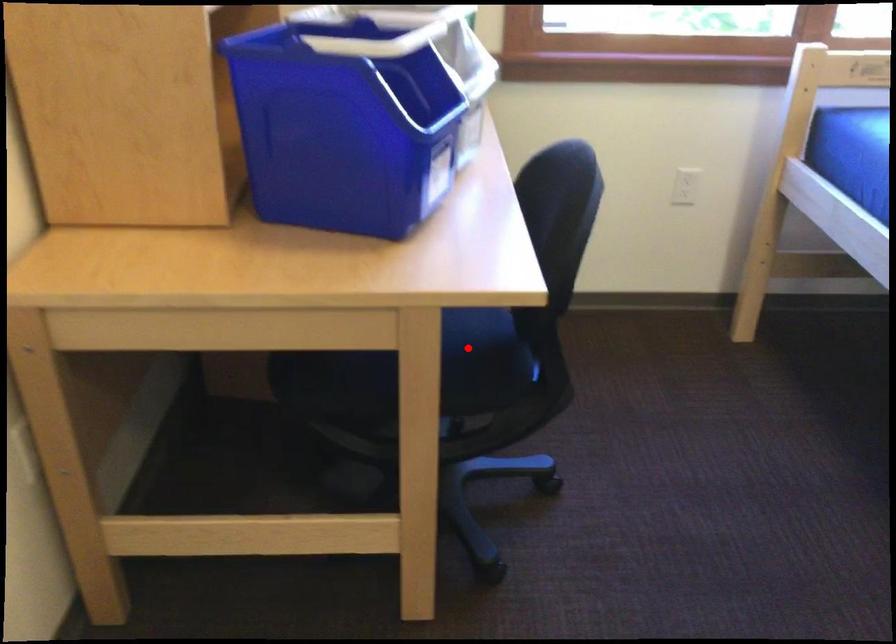
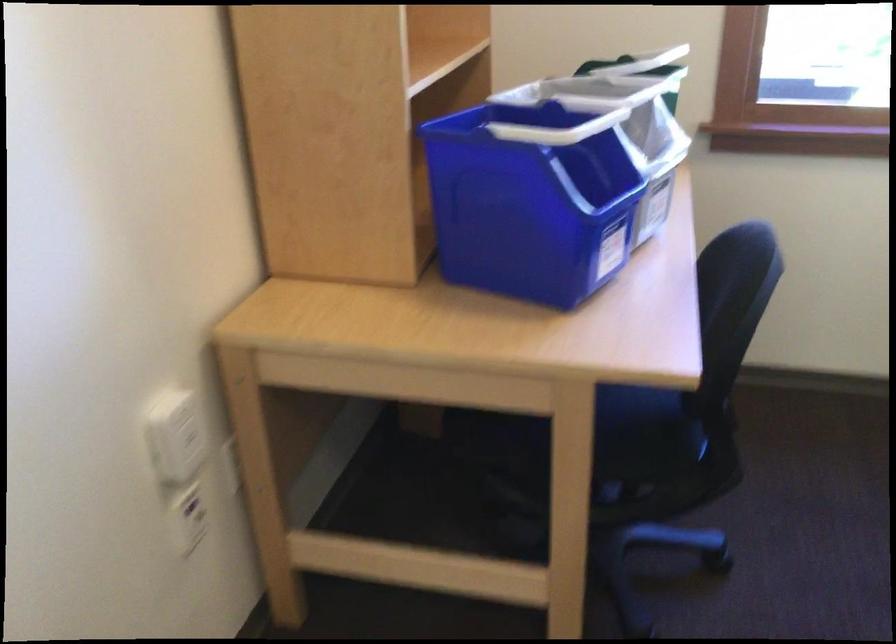
Locate, in the second image, the point that corresponds to the highlighted location in the first image.

(633, 415)